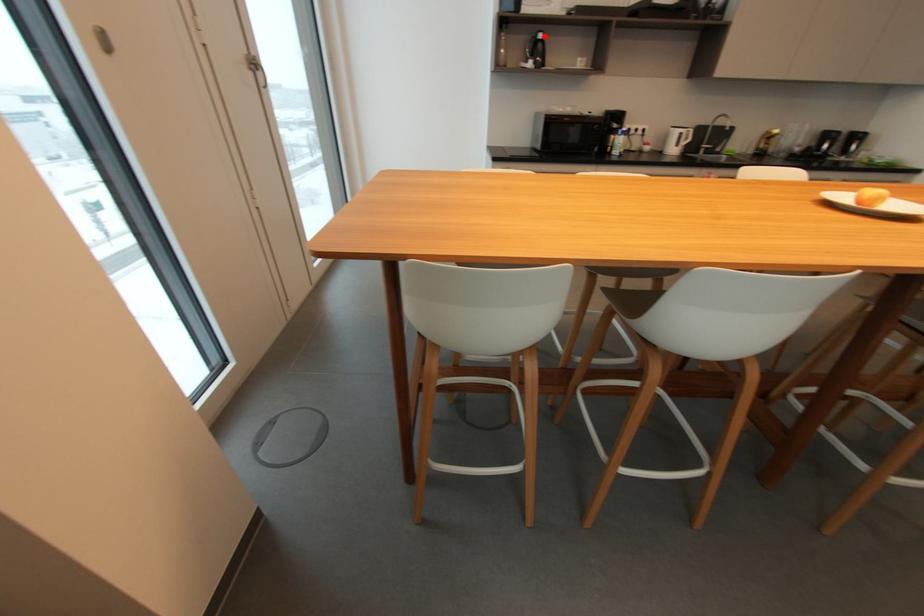
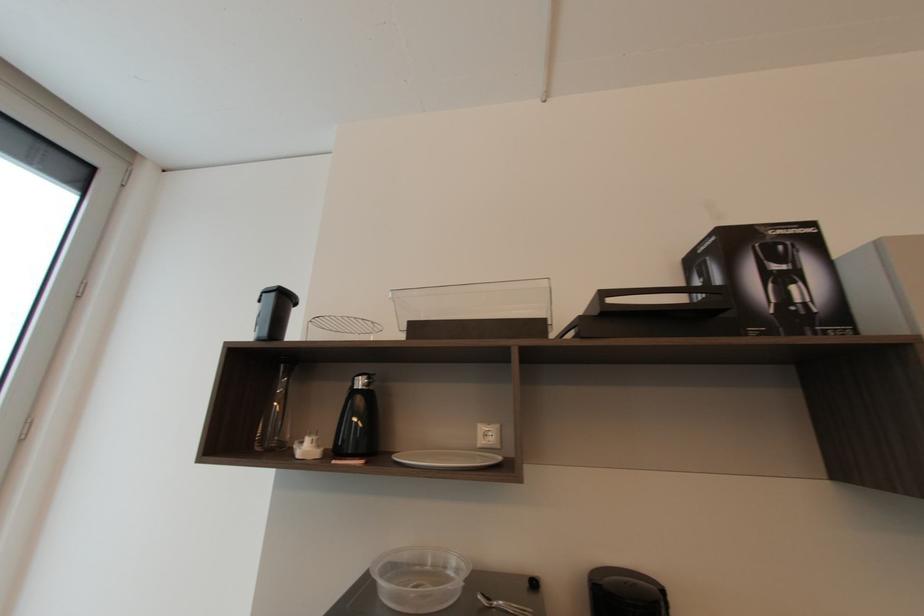
Locate, in the second image, the point that corresponds to the highlighted location in the first image.

(362, 384)